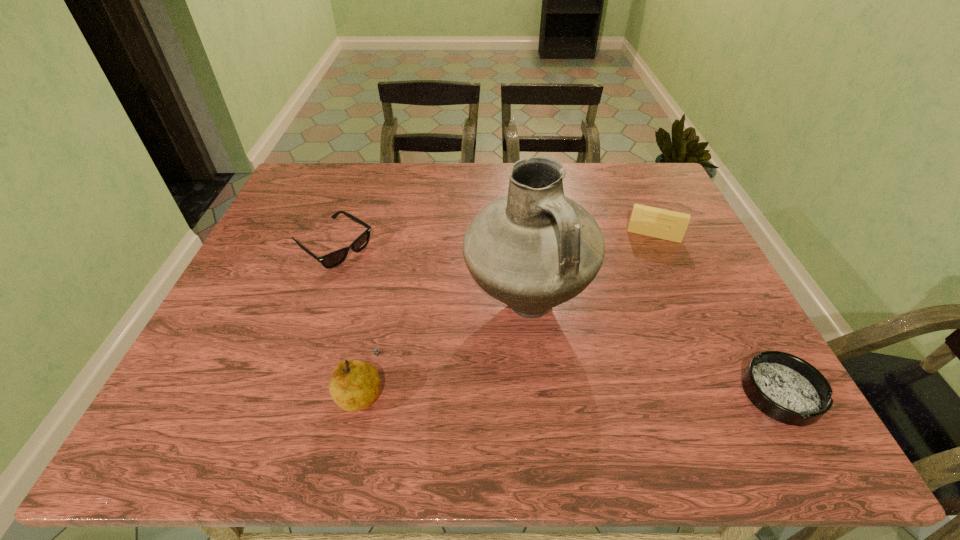
You are a GUI agent. You are given a task and a screenshot of the screen. Output one action in this format:
    pyautogui.click(x=<x>, y=<y>)
    Task: Click on the ashtray at the near edge
    
    Given the screenshot: What is the action you would take?
    pyautogui.click(x=786, y=388)

Where is `object present at the left edge`? This screenshot has height=540, width=960. object present at the left edge is located at coordinates (333, 259).

Identify the location of ashtray that is at the right edge. (786, 388).

This screenshot has width=960, height=540. I want to click on videotape that is at the right edge, so click(664, 224).

Where is `object present at the near right corner`? Image resolution: width=960 pixels, height=540 pixels. object present at the near right corner is located at coordinates (786, 388).

Where is `free space at the far edge`? free space at the far edge is located at coordinates (427, 180).

In the image, there is a desktop. Where is `vacant space at the near edge`? Image resolution: width=960 pixels, height=540 pixels. vacant space at the near edge is located at coordinates (624, 364).

In the image, there is a desktop. Identify the location of vacant area at the left edge. (312, 238).

This screenshot has height=540, width=960. Find the location of `vacant area at the right edge`. vacant area at the right edge is located at coordinates (662, 270).

Locate an element on the screen. vacant space at the far left corner of the desktop is located at coordinates (303, 190).